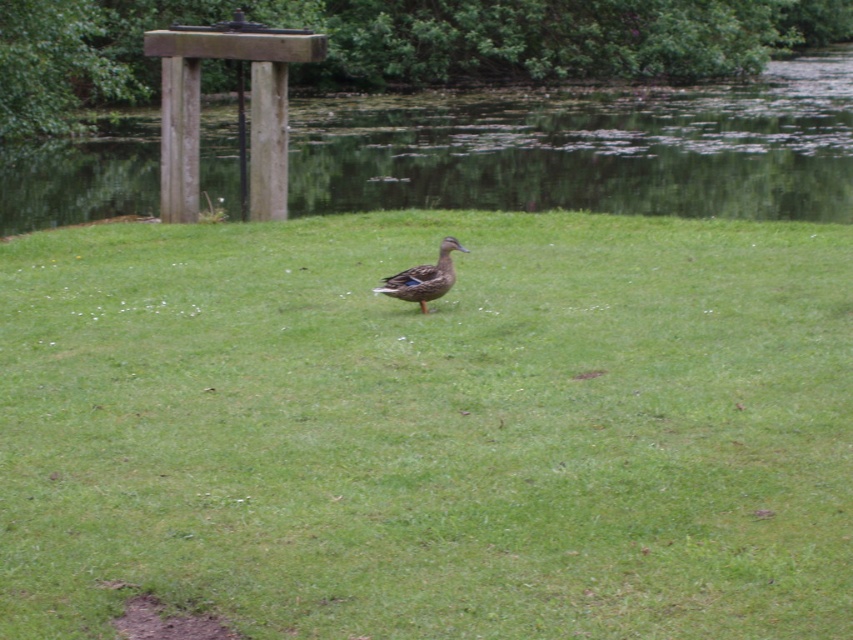
Question: Which of these objects is positioned farthest from the green grassy at center?

Choices:
 (A) shiny brown duck at center
 (B) green grassy field at lower center

Answer: (B)

Question: Can you confirm if green grassy at center is positioned below shiny brown duck at center?

Choices:
 (A) no
 (B) yes

Answer: (B)

Question: Is green grassy at center smaller than green grassy field at lower center?

Choices:
 (A) yes
 (B) no

Answer: (A)

Question: Which object is closer to the camera taking this photo?

Choices:
 (A) green grassy at center
 (B) shiny brown duck at center

Answer: (A)

Question: Which object is the farthest from the green grassy field at lower center?

Choices:
 (A) green grassy at center
 (B) shiny brown duck at center

Answer: (B)

Question: Observing the image, what is the correct spatial positioning of green grassy at center in reference to green grassy field at lower center?

Choices:
 (A) above
 (B) below

Answer: (B)